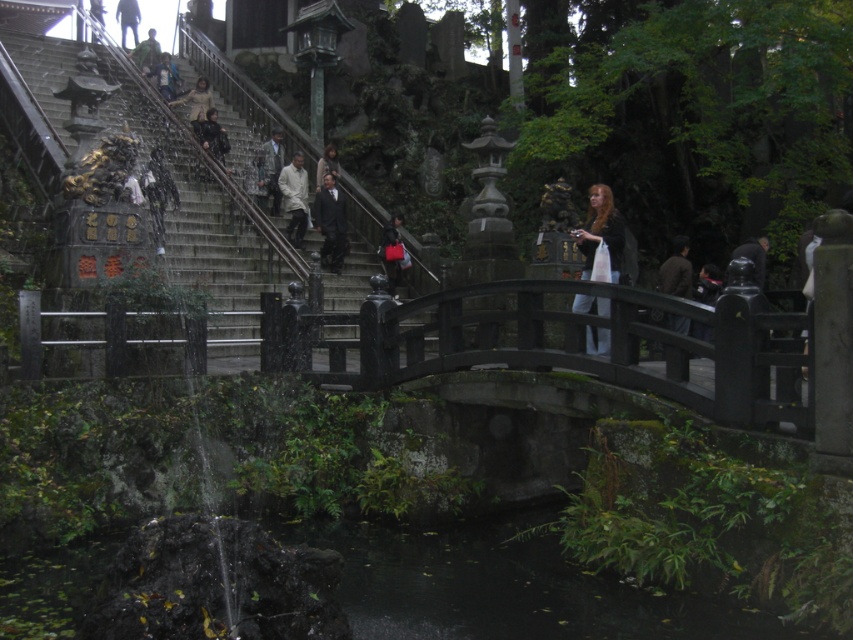
You are a visitor at the temple and want to take a photo of both the brown leather jacket at upper center and the smooth black statue at center. Which object should you focus on first to ensure both are in frame?

The brown leather jacket at upper center is much taller than the smooth black statue at center, so you should focus on the brown leather jacket at upper center first to ensure both fit within the camera frame.

In the scene shown: You are a visitor at the temple and see the dark gray stone pond at lower center and the light brown leather jacket at upper center. Which object is taller?

The light brown leather jacket at upper center is taller than the dark gray stone pond at lower center.